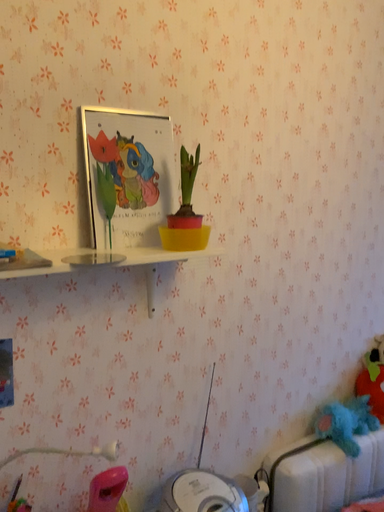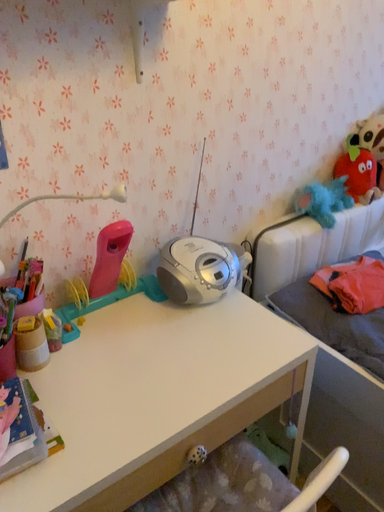
Question: How did the camera likely rotate when shooting the video?

Choices:
 (A) rotated downward
 (B) rotated upward

Answer: (A)